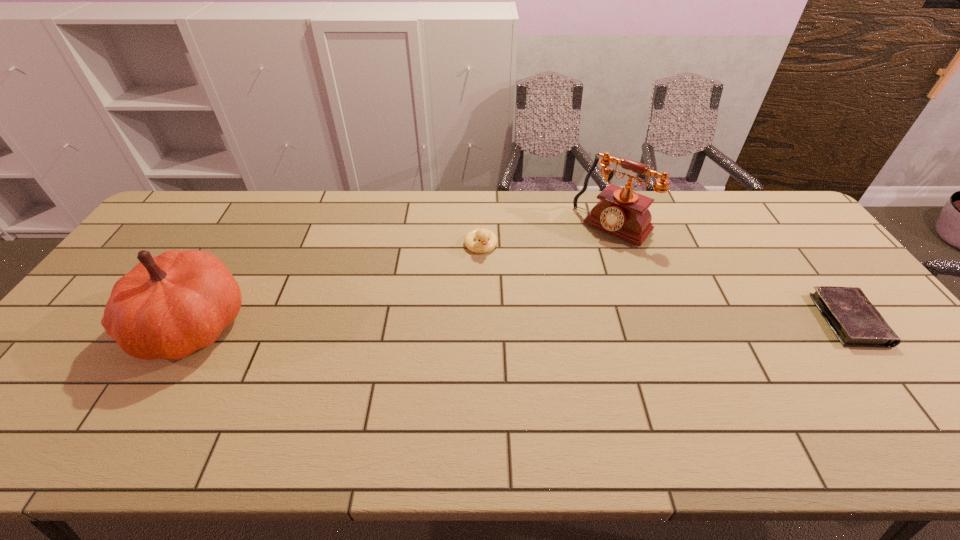
The height and width of the screenshot is (540, 960). What are the coordinates of `free space on the desktop that is between the pumpkin and the rightmost object and is positioned on the dial of the third object from left to right` in the screenshot? It's located at (528, 322).

Find the location of a particular element. This screenshot has height=540, width=960. free space on the desktop that is between the leftmost object and the rightmost object and is positioned at the beak of the third tallest object is located at coordinates (502, 323).